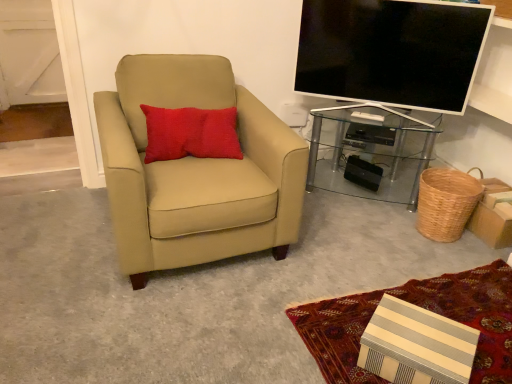
Measure the distance between matte black tv at upper right and camera.

matte black tv at upper right is 6.47 feet from camera.

The height and width of the screenshot is (384, 512). I want to click on transparent glass desk at right, so click(x=371, y=152).

Where is `red textured pillow at upper left`? The width and height of the screenshot is (512, 384). red textured pillow at upper left is located at coordinates (191, 133).

Where is `woven brown basket at lower right`? woven brown basket at lower right is located at coordinates (446, 202).

Considering the sizes of objects beige leather chair at left and matte black tv at upper right in the image provided, who is wider, beige leather chair at left or matte black tv at upper right?

beige leather chair at left is wider.

Identify the location of television above the beige leather chair at left (from a real-world perspective). (391, 51).

Is beige leather chair at left bigger than matte black tv at upper right?

Yes, beige leather chair at left is bigger than matte black tv at upper right.

Is beige leather chair at left next to matte black tv at upper right and touching it?

beige leather chair at left and matte black tv at upper right are clearly separated.

Is red textured pillow at upper left looking in the opposite direction of woven brown basket at lower right?

No, red textured pillow at upper left is not facing the opposite direction of woven brown basket at lower right.

Can you confirm if red textured pillow at upper left is shorter than woven brown basket at lower right?

No.

Is red textured pillow at upper left closer to the viewer compared to woven brown basket at lower right?

Yes, it is in front of woven brown basket at lower right.

Is woven brown basket at lower right oriented towards matte black tv at upper right?

No, woven brown basket at lower right is not turned towards matte black tv at upper right.

From the image's perspective, is woven brown basket at lower right over matte black tv at upper right?

Incorrect, from the image's perspective, woven brown basket at lower right is lower than matte black tv at upper right.

Considering the relative positions of woven brown basket at lower right and matte black tv at upper right in the image provided, is woven brown basket at lower right in front of matte black tv at upper right?

That is False.

From a real-world perspective, is woven brown basket at lower right physically located above or below matte black tv at upper right?

Clearly, from a real-world perspective, woven brown basket at lower right is below matte black tv at upper right.

Between red textured pillow at upper left and matte black tv at upper right, which one has more height?

Standing taller between the two is matte black tv at upper right.

Looking at this image, is red textured pillow at upper left to the right of matte black tv at upper right from the viewer's perspective?

No, red textured pillow at upper left is not to the right of matte black tv at upper right.

Is the surface of red textured pillow at upper left in direct contact with matte black tv at upper right?

red textured pillow at upper left and matte black tv at upper right are clearly separated.

Identify the location of pillow in front of the matte black tv at upper right. This screenshot has width=512, height=384. (191, 133).

Consider the image. How different are the orientations of red textured pillow at upper left and transparent glass desk at right in degrees?

There is a 32.2-degree angle between the facing directions of red textured pillow at upper left and transparent glass desk at right.

Consider the image. Is red textured pillow at upper left oriented towards transparent glass desk at right?

No, red textured pillow at upper left does not turn towards transparent glass desk at right.

Considering the sizes of objects red textured pillow at upper left and transparent glass desk at right in the image provided, who is taller, red textured pillow at upper left or transparent glass desk at right?

transparent glass desk at right.

Measure the distance between red textured pillow at upper left and transparent glass desk at right.

38.72 inches.

Considering the positions of point (409, 11) and point (238, 152), is point (409, 11) closer or farther from the camera than point (238, 152)?

Point (409, 11) appears to be farther away from the viewer than point (238, 152).

From the image's perspective, is matte black tv at upper right located above red textured pillow at upper left?

Yes.

Between matte black tv at upper right and red textured pillow at upper left, which one is positioned in front?

red textured pillow at upper left is in front.

From a real-world perspective, is matte black tv at upper right physically below red textured pillow at upper left?

Actually, matte black tv at upper right is physically above red textured pillow at upper left in the real world.

Is point (352, 111) closer or farther from the camera than point (172, 137)?

Point (352, 111) appears to be farther away from the viewer than point (172, 137).

Find the location of a particular element. This screenshot has width=512, height=384. pillow in front of the transparent glass desk at right is located at coordinates (191, 133).

Is transparent glass desk at right spatially inside red textured pillow at upper left, or outside of it?

transparent glass desk at right is spatially situated outside red textured pillow at upper left.

Is transparent glass desk at right to the right of red textured pillow at upper left from the viewer's perspective?

Correct, you'll find transparent glass desk at right to the right of red textured pillow at upper left.

I want to click on television above the beige leather chair at left (from a real-world perspective), so point(391,51).

Find the location of a particular element. This screenshot has width=512, height=384. basket below the red textured pillow at upper left (from the image's perspective) is located at coordinates (446, 202).

Considering their positions, is matte black tv at upper right positioned further to woven brown basket at lower right than transparent glass desk at right?

Based on the image, matte black tv at upper right appears to be further to woven brown basket at lower right.

When comparing their distances from woven brown basket at lower right, does transparent glass desk at right or matte black tv at upper right seem further?

Based on the image, matte black tv at upper right appears to be further to woven brown basket at lower right.

Based on their spatial positions, is matte black tv at upper right or beige leather chair at left closer to woven brown basket at lower right?

Based on the image, matte black tv at upper right appears to be nearer to woven brown basket at lower right.

Estimate the real-world distances between objects in this image. Which object is further from red textured pillow at upper left, transparent glass desk at right or matte black tv at upper right?

Based on the image, transparent glass desk at right appears to be further to red textured pillow at upper left.

Based on the photo, looking at the image, which one is located closer to matte black tv at upper right, transparent glass desk at right or beige leather chair at left?

transparent glass desk at right is positioned closer to the anchor matte black tv at upper right.

Looking at this image, which object lies further to the anchor point transparent glass desk at right, beige leather chair at left or woven brown basket at lower right?

beige leather chair at left is positioned further to the anchor transparent glass desk at right.

From the picture: Considering their positions, is red textured pillow at upper left positioned further to matte black tv at upper right than beige leather chair at left?

red textured pillow at upper left lies further to matte black tv at upper right than the other object.

Looking at the image, which one is located closer to matte black tv at upper right, transparent glass desk at right or woven brown basket at lower right?

transparent glass desk at right.

This screenshot has width=512, height=384. I want to click on desk between red textured pillow at upper left and woven brown basket at lower right in the horizontal direction, so click(371, 152).

Where is `pillow between beige leather chair at left and transparent glass desk at right`? pillow between beige leather chair at left and transparent glass desk at right is located at coordinates (191, 133).

In order to click on television between red textured pillow at upper left and woven brown basket at lower right in the horizontal direction in this screenshot , I will do [x=391, y=51].

I want to click on television between beige leather chair at left and transparent glass desk at right, so click(x=391, y=51).